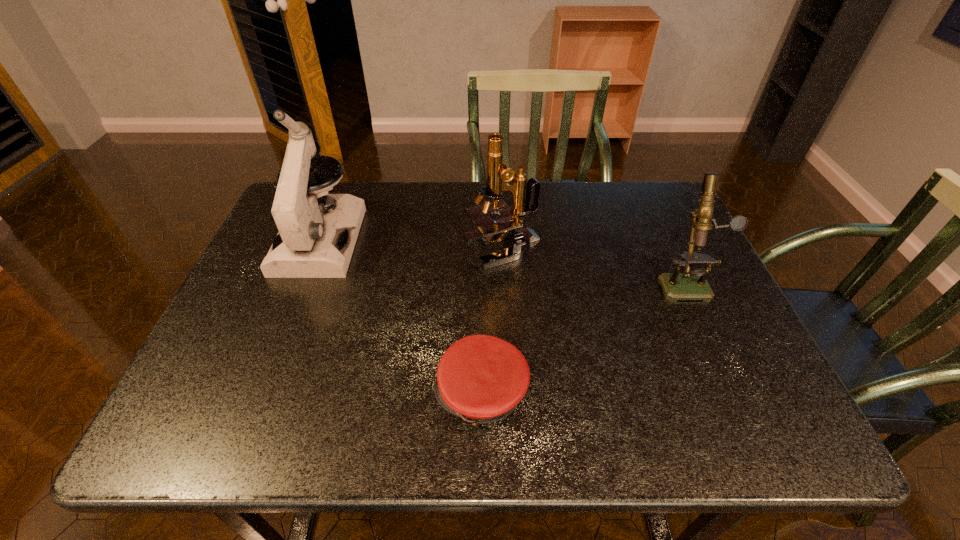
Where is `the leftmost microscope`? The image size is (960, 540). the leftmost microscope is located at coordinates (310, 244).

Find the location of `the second microscope from right to left`. the second microscope from right to left is located at coordinates (510, 226).

This screenshot has width=960, height=540. What are the coordinates of `the second shortest object` in the screenshot? It's located at [x=692, y=285].

In order to click on the rightmost object in this screenshot , I will do pos(692,285).

Identify the location of the shortest object. (480, 378).

At what (x,y) coordinates should I click in order to perform the action: click on the nearest object. Please return your answer as a coordinate pair (x, y). The image size is (960, 540). Looking at the image, I should click on (480, 378).

What are the coordinates of `vacant space located at the eyepiece of the leftmost object` in the screenshot? It's located at (259, 395).

The image size is (960, 540). Identify the location of free space located 0.180m at the eyepiece of the second microscope from right to left. tap(396, 248).

The width and height of the screenshot is (960, 540). In order to click on vacant space situated at the eyepiece of the second microscope from right to left in this screenshot , I will do `click(382, 248)`.

Where is `vacant space situated at the eyepiece of the second microscope from right to left`? Image resolution: width=960 pixels, height=540 pixels. vacant space situated at the eyepiece of the second microscope from right to left is located at coordinates [x=315, y=248].